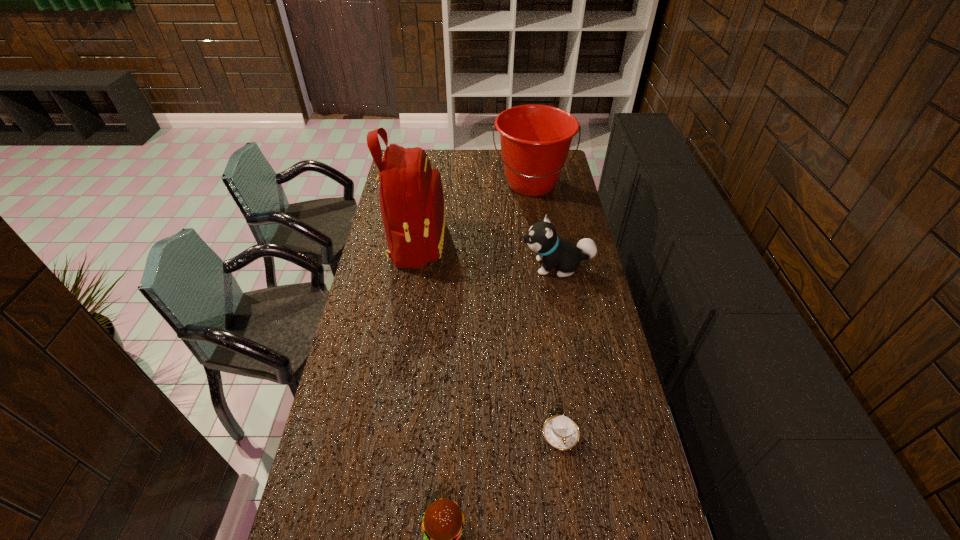
The width and height of the screenshot is (960, 540). Identify the location of backpack. (411, 198).

Locate an element on the screen. The image size is (960, 540). the leftmost object is located at coordinates (411, 198).

At what (x,y) coordinates should I click in order to perform the action: click on the farthest object. Please return your answer as a coordinate pair (x, y). This screenshot has width=960, height=540. Looking at the image, I should click on (535, 140).

Where is `bucket`? The height and width of the screenshot is (540, 960). bucket is located at coordinates point(535,140).

Identify the location of the third tallest object. (542, 238).

The width and height of the screenshot is (960, 540). Find the location of `teacup`. teacup is located at coordinates (561, 432).

This screenshot has height=540, width=960. Find the location of `the shortest object`. the shortest object is located at coordinates (561, 432).

The image size is (960, 540). What are the coordinates of `free space located 0.110m on the front-facing side of the backpack` in the screenshot? It's located at (471, 243).

Locate an element on the screen. free location located with the handle attached to the rim of the second tallest object is located at coordinates (539, 235).

Identify the location of free spot located 0.070m at the face of the puppy. (503, 266).